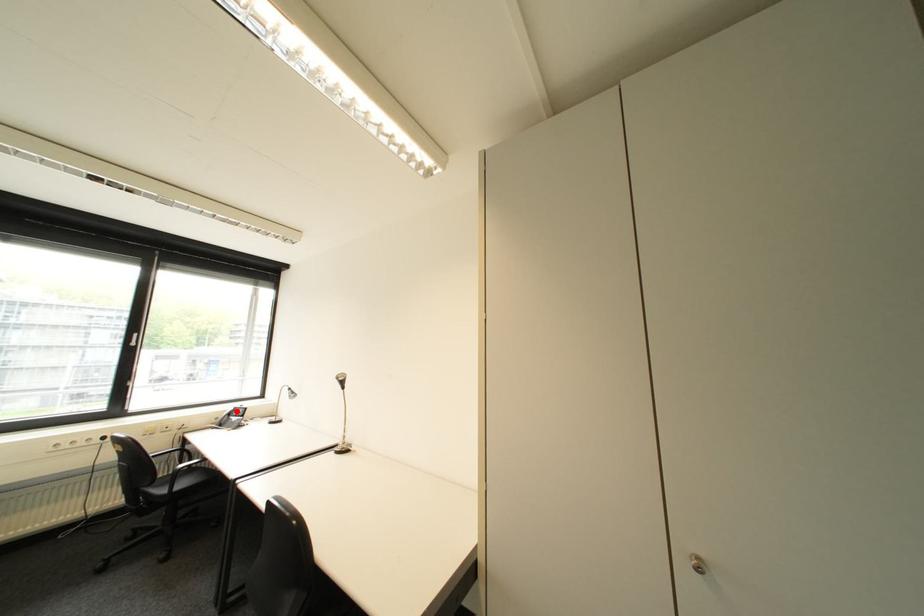
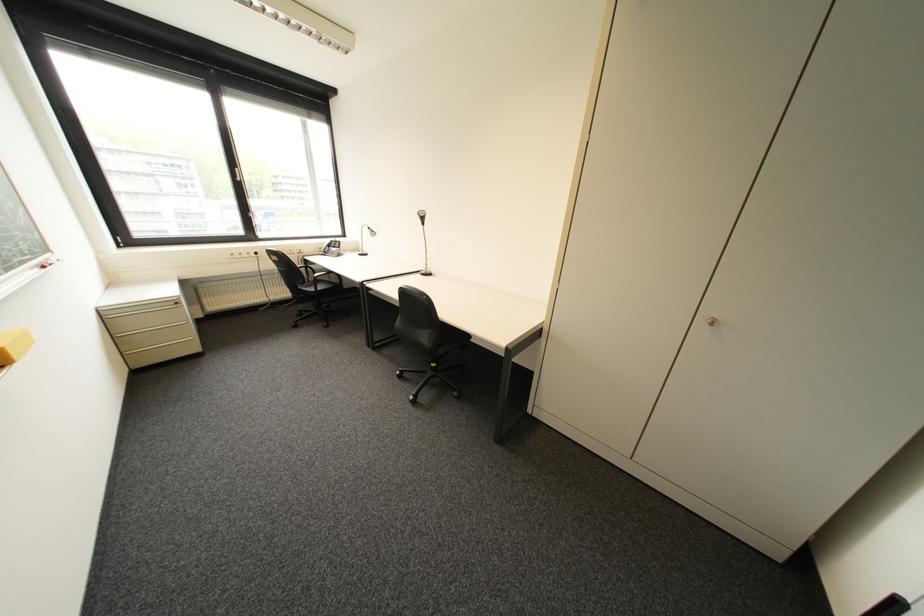
Find the pixel in the second image that matches the highlighted location in the first image.

(335, 244)